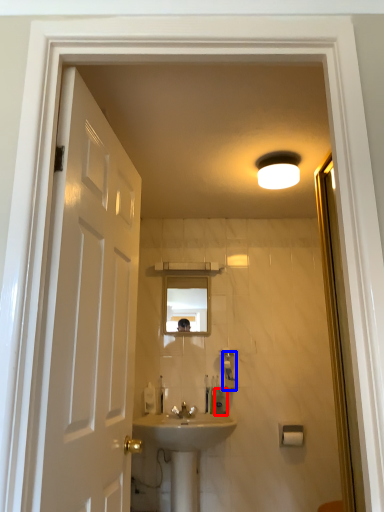
Question: Among these objects, which one is nearest to the camera, toiletry (highlighted by a red box) or soap dispenser (highlighted by a blue box)?

Choices:
 (A) toiletry
 (B) soap dispenser

Answer: (B)